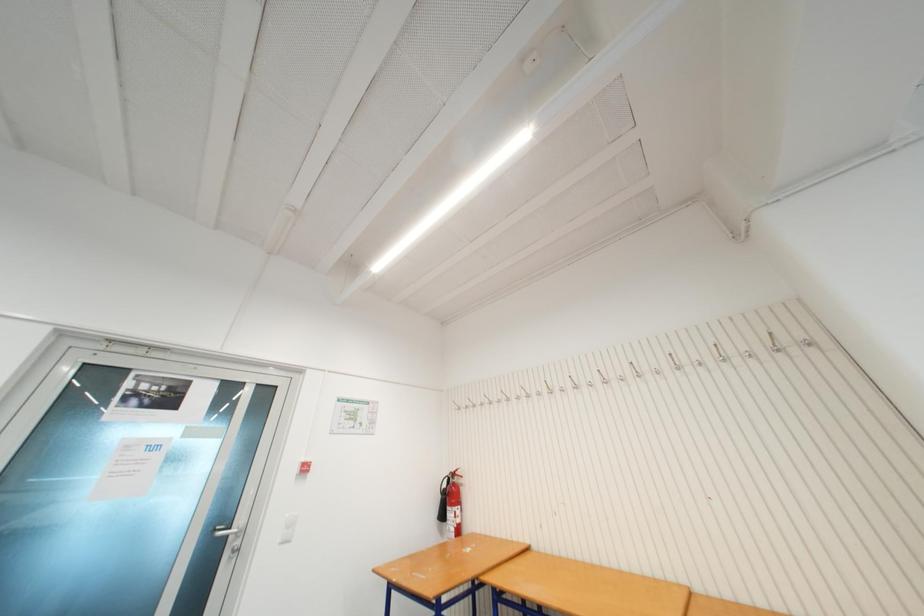
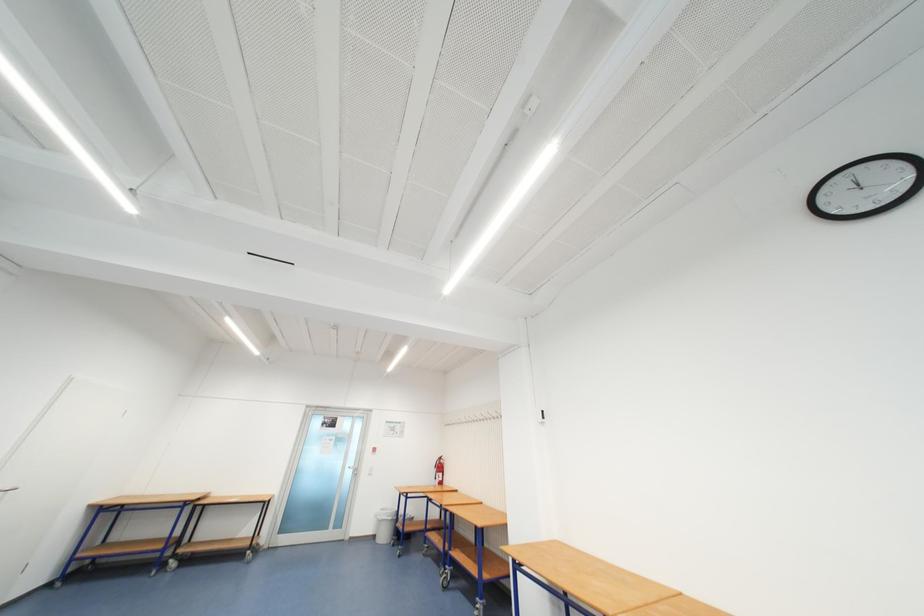
In a continuous first-person perspective shot, in which direction is the camera moving?

The movement direction of the cameraman is right, backward.